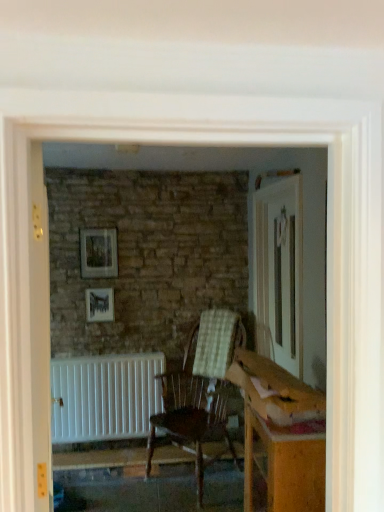
Question: From the image's perspective, is wooden chair with checkered cushion at center above wooden frame at upper center, which is counted as the 1th picture frame, starting from the top?

Choices:
 (A) no
 (B) yes

Answer: (A)

Question: Does wooden chair with checkered cushion at center touch wooden frame at upper center, the 2th picture frame when ordered from bottom to top?

Choices:
 (A) no
 (B) yes

Answer: (A)

Question: Would you say wooden frame at upper center, which is counted as the 1th picture frame, starting from the top, is part of wooden chair with checkered cushion at center's contents?

Choices:
 (A) no
 (B) yes

Answer: (A)

Question: Does wooden chair with checkered cushion at center lie in front of wooden frame at upper center, which is counted as the 1th picture frame, starting from the top?

Choices:
 (A) yes
 (B) no

Answer: (A)

Question: From a real-world perspective, is wooden chair with checkered cushion at center located higher than wooden frame at upper center, which is counted as the 1th picture frame, starting from the top?

Choices:
 (A) yes
 (B) no

Answer: (B)

Question: Choose the correct answer: Is wooden frame at upper center, the 2th picture frame when ordered from bottom to top, inside white matte radiator at lower left or outside it?

Choices:
 (A) outside
 (B) inside

Answer: (A)

Question: Considering the positions of wooden frame at upper center, the 2th picture frame when ordered from bottom to top, and white matte radiator at lower left in the image, is wooden frame at upper center, the 2th picture frame when ordered from bottom to top, taller or shorter than white matte radiator at lower left?

Choices:
 (A) short
 (B) tall

Answer: (A)

Question: Is wooden frame at upper center, which is counted as the 1th picture frame, starting from the top, bigger or smaller than white matte radiator at lower left?

Choices:
 (A) small
 (B) big

Answer: (A)

Question: Considering the positions of wooden frame at upper center, the 2th picture frame when ordered from bottom to top, and white matte radiator at lower left in the image, is wooden frame at upper center, the 2th picture frame when ordered from bottom to top, wider or thinner than white matte radiator at lower left?

Choices:
 (A) wide
 (B) thin

Answer: (B)

Question: Is wooden chair with checkered cushion at center situated inside white matte radiator at lower left or outside?

Choices:
 (A) outside
 (B) inside

Answer: (A)

Question: From a real-world perspective, is wooden chair with checkered cushion at center above or below white matte radiator at lower left?

Choices:
 (A) above
 (B) below

Answer: (A)

Question: Considering the positions of wooden chair with checkered cushion at center and white matte radiator at lower left in the image, is wooden chair with checkered cushion at center bigger or smaller than white matte radiator at lower left?

Choices:
 (A) small
 (B) big

Answer: (B)

Question: From their relative heights in the image, would you say wooden chair with checkered cushion at center is taller or shorter than white matte radiator at lower left?

Choices:
 (A) short
 (B) tall

Answer: (B)

Question: In the image, is white matte radiator at lower left on the left side or the right side of wooden frame at upper center, the 2th picture frame when ordered from bottom to top?

Choices:
 (A) right
 (B) left

Answer: (A)

Question: Does point (137, 394) appear closer or farther from the camera than point (84, 241)?

Choices:
 (A) closer
 (B) farther

Answer: (A)